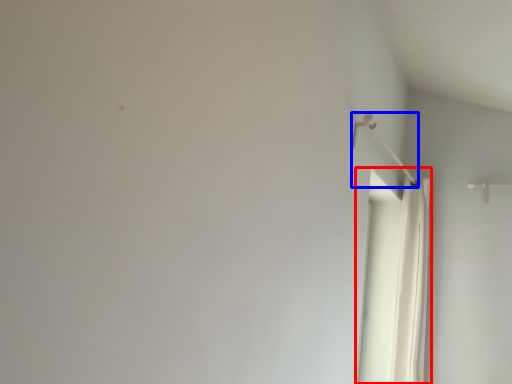
Question: Which of the following is the closest to the observer, shower curtain (highlighted by a red box) or shower (highlighted by a blue box)?

Choices:
 (A) shower curtain
 (B) shower

Answer: (B)